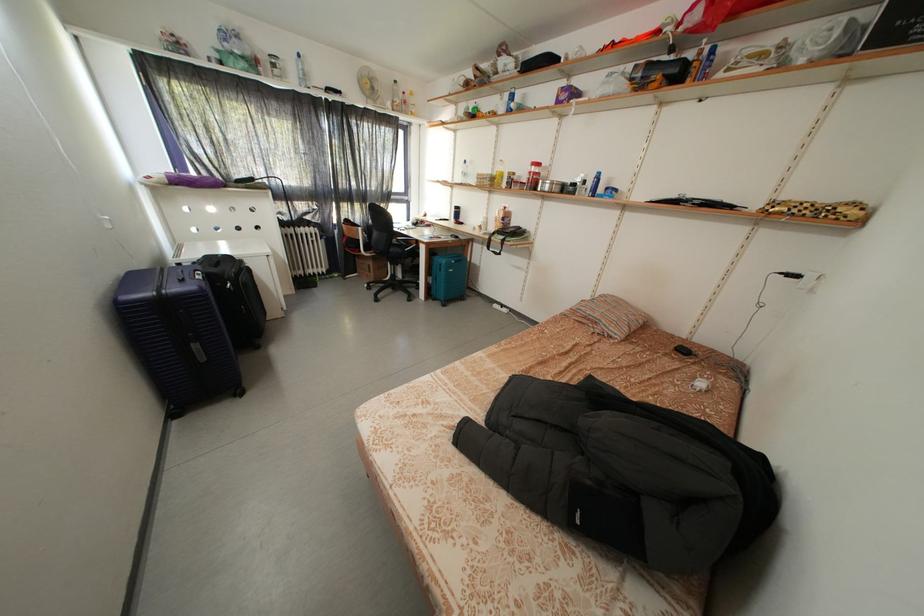
Find where to lift the metal bowl. Please return your answer as a coordinate pair (x, y).

(551, 185)